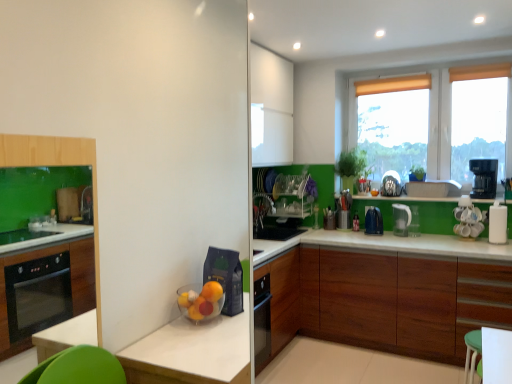
You are a GUI agent. You are given a task and a screenshot of the screen. Output one action in this format:
    pyautogui.click(x=<x>, y=<y>)
    Task: Click on the vacant space to the right of clear plastic pitcher at upper right, which is the 2th kitchen appliance from left to right
    The width and height of the screenshot is (512, 384).
    Given the screenshot: What is the action you would take?
    pyautogui.click(x=425, y=237)